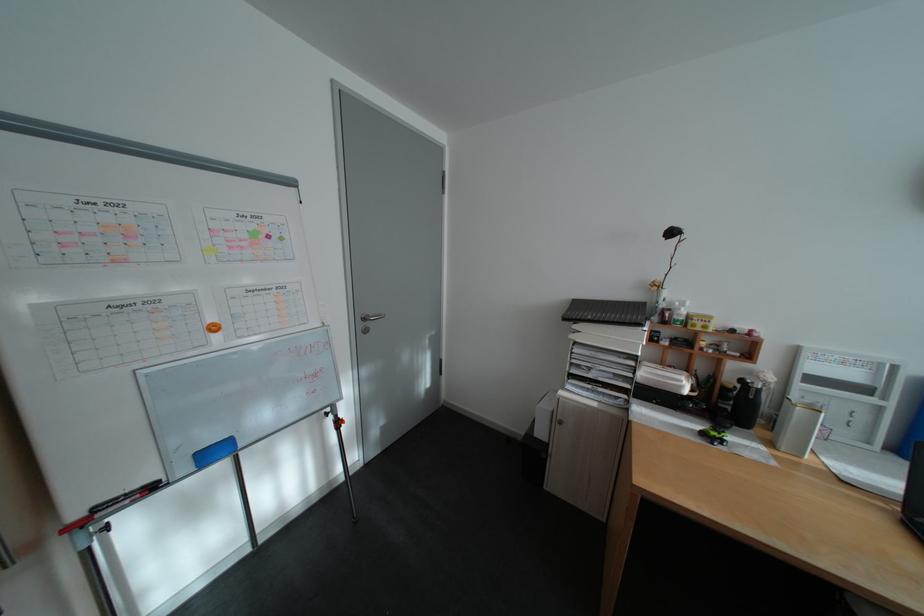
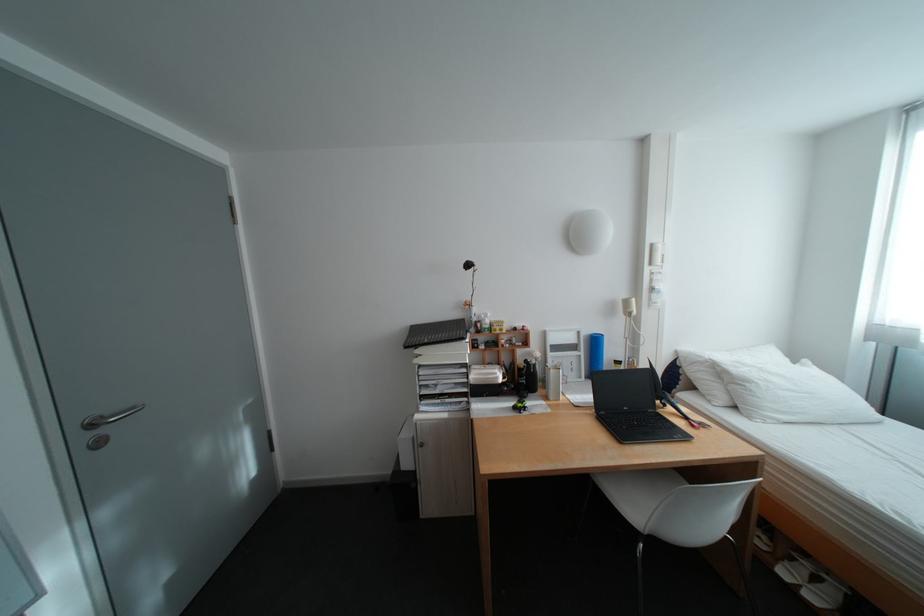
Find the pixel in the second image that matches point 708,395 in the first image.

(518, 381)